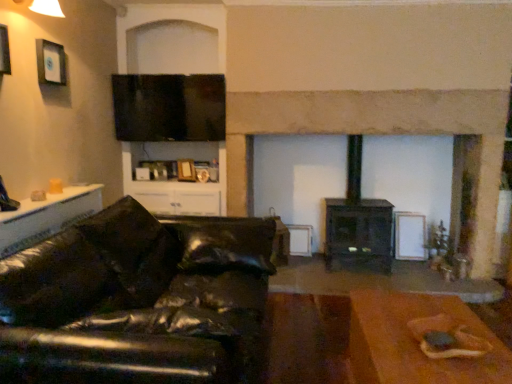
Question: Looking at their shapes, would you say brown wooden table at lower right, which is the first table from bottom to top, is wider or thinner than black leather couch at left?

Choices:
 (A) thin
 (B) wide

Answer: (A)

Question: From a real-world perspective, is brown wooden table at lower right, the second table viewed from the left, above or below black leather couch at left?

Choices:
 (A) above
 (B) below

Answer: (B)

Question: Estimate the real-world distances between objects in this image. Which object is closer to the flat matte screen at upper center?

Choices:
 (A) brown wooden table at lower right, arranged as the first table when viewed from the right
 (B) white glossy table at left, the first table from the left
 (C) black leather couch at left
 (D) black matte wood burning stove at center

Answer: (B)

Question: Estimate the real-world distances between objects in this image. Which object is closer to the black matte wood burning stove at center?

Choices:
 (A) black leather couch at left
 (B) white glossy table at left, which is the second table from right to left
 (C) flat matte screen at upper center
 (D) brown wooden table at lower right, the second table viewed from the left

Answer: (C)